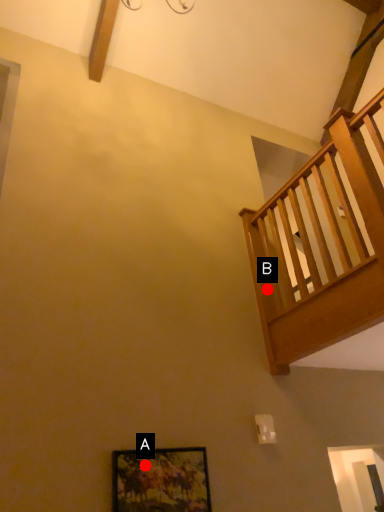
Question: Two points are circled on the image, labeled by A and B beside each circle. Which point is farther from the camera taking this photo?

Choices:
 (A) A is further
 (B) B is further

Answer: (B)